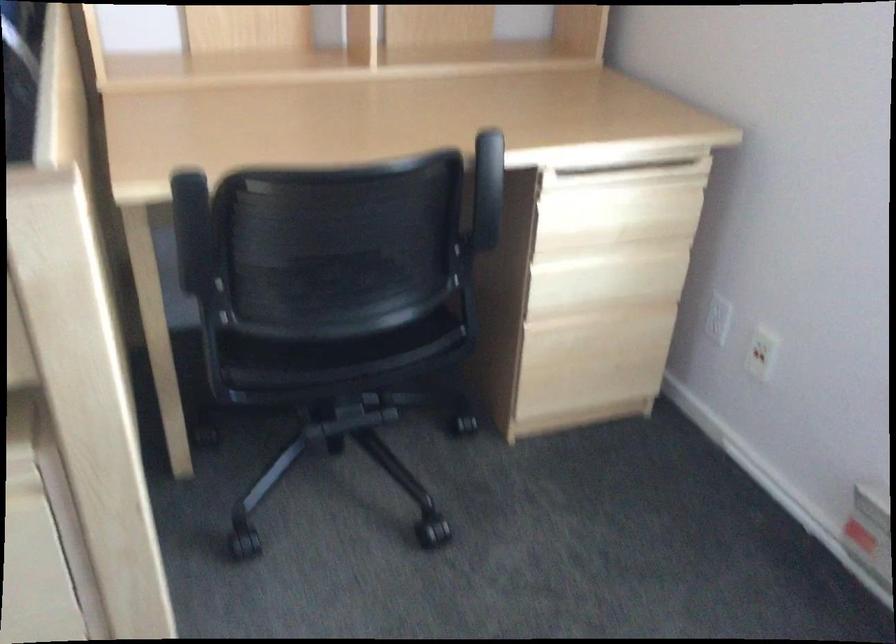
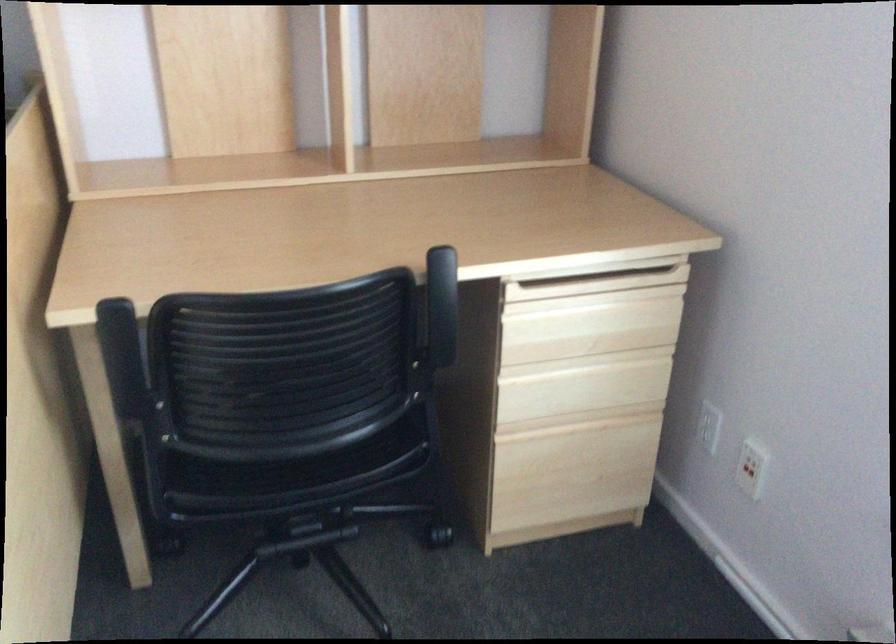
Locate, in the second image, the point that corresponds to (x=756, y=357) in the first image.

(747, 471)